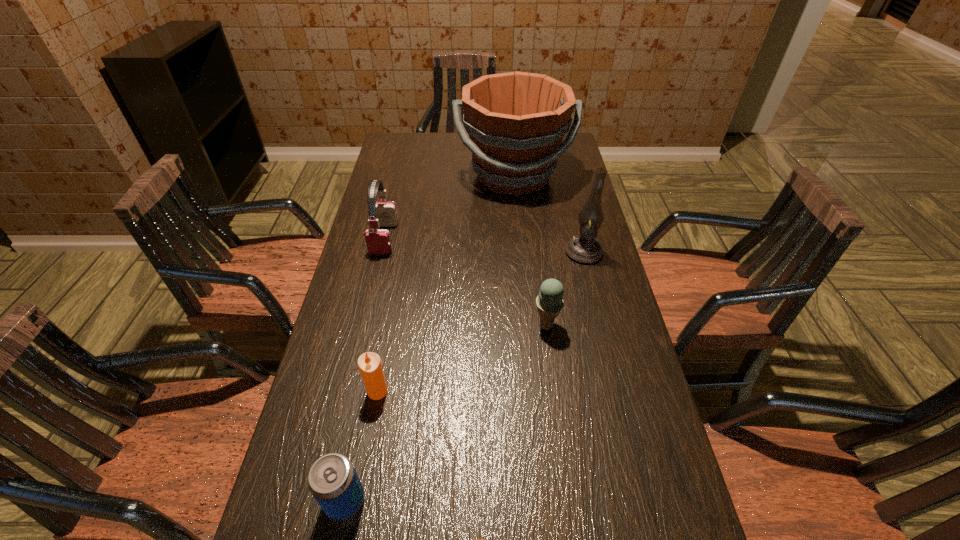
You are a GUI agent. You are given a task and a screenshot of the screen. Output one action in this format:
    pyautogui.click(x=<x>, y=<y>)
    Task: Click on the free region at the left edge of the desktop
    The height and width of the screenshot is (540, 960).
    Given the screenshot: What is the action you would take?
    pyautogui.click(x=413, y=214)

Find the location of a particular element. vacant space at the right edge of the desktop is located at coordinates (611, 282).

Image resolution: width=960 pixels, height=540 pixels. Find the location of `free space at the far right corner`. free space at the far right corner is located at coordinates (562, 155).

Where is `free space that is in between the farthest object and the earphone`? The height and width of the screenshot is (540, 960). free space that is in between the farthest object and the earphone is located at coordinates (448, 207).

I want to click on free space between the beer can and the oil lamp, so click(465, 376).

Locate an element on the screen. The height and width of the screenshot is (540, 960). free space that is in between the beer can and the bucket is located at coordinates (429, 338).

I want to click on free space between the third nearest object and the fifth shortest object, so click(x=381, y=315).

This screenshot has height=540, width=960. Find the location of `free space between the fourth nearest object and the fifth farthest object`. free space between the fourth nearest object and the fifth farthest object is located at coordinates (462, 358).

Identify which object is the nearest to the earphone. Please provide its 2D coordinates. Your answer should be formatted as a tuple, i.e. [(x, y)], where the tuple contains the x and y coordinates of a point satisfying the conditions above.

[(516, 121)]

Find the location of a particular element. object that is the fifth closest one to the sixth farthest object is located at coordinates (584, 248).